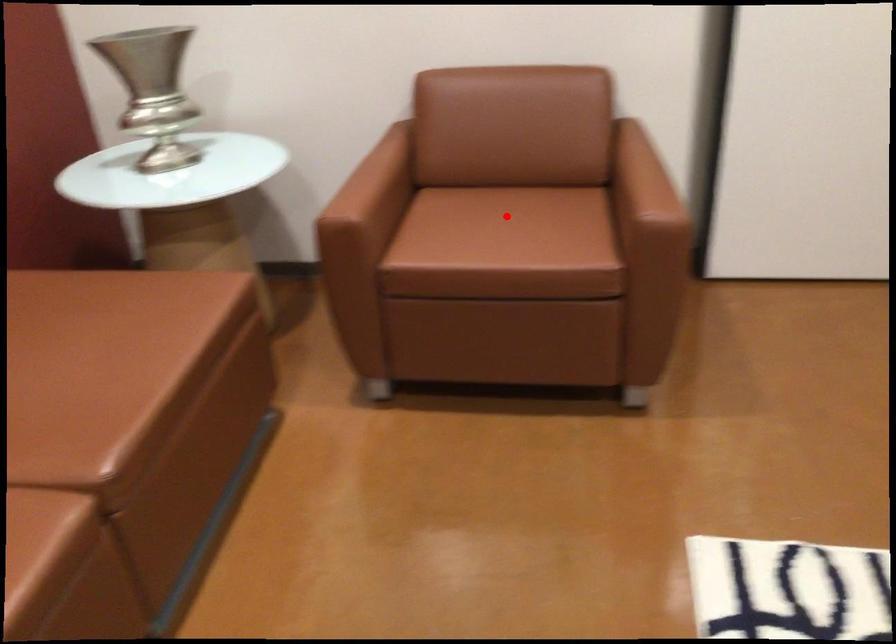
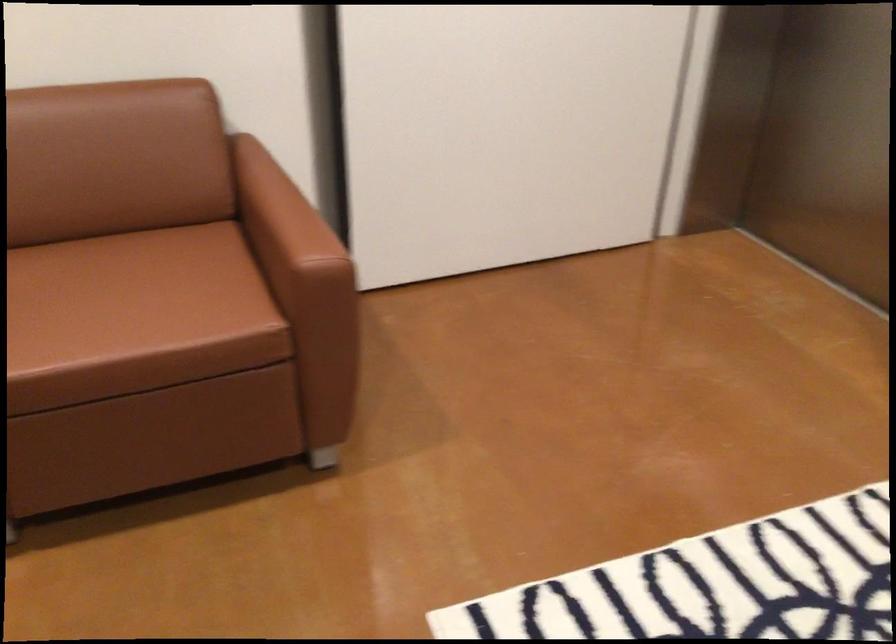
Where in the second image is the point corresponding to the highlighted location from the first image?

(124, 283)